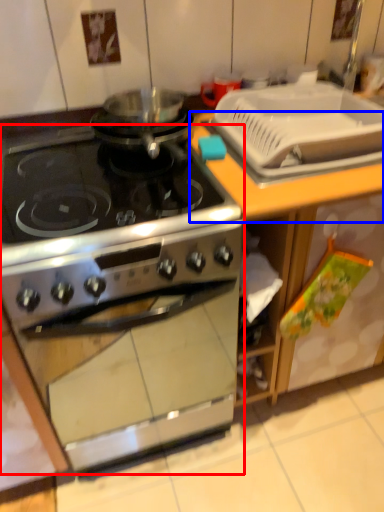
Question: Which object is further to the camera taking this photo, kitchen appliance (highlighted by a red box) or counter top (highlighted by a blue box)?

Choices:
 (A) kitchen appliance
 (B) counter top

Answer: (B)